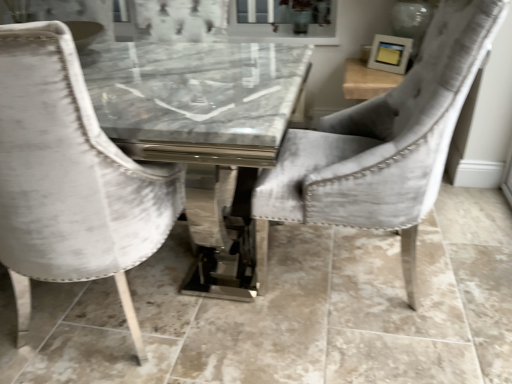
Where is `free space below velvet white chair at left, the second chair positioned from the right (from a real-world perspective)`? free space below velvet white chair at left, the second chair positioned from the right (from a real-world perspective) is located at coordinates (105, 313).